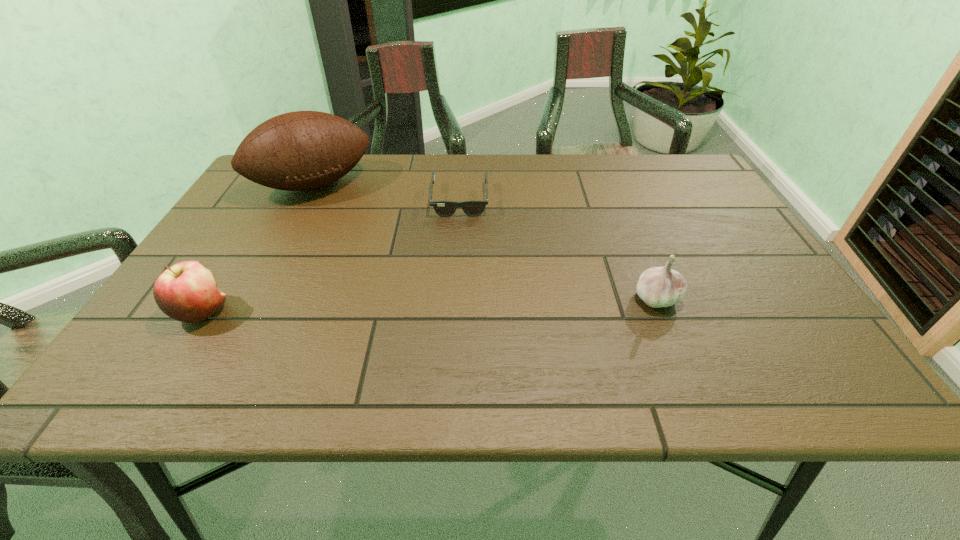
Where is `free area in between the sunglasses and the apple`? The height and width of the screenshot is (540, 960). free area in between the sunglasses and the apple is located at coordinates (331, 256).

Locate an element on the screen. This screenshot has width=960, height=540. vacant space that's between the rightmost object and the apple is located at coordinates (430, 305).

At what (x,y) coordinates should I click in order to perform the action: click on vacant area that lies between the apple and the sunglasses. Please return your answer as a coordinate pair (x, y). The width and height of the screenshot is (960, 540). Looking at the image, I should click on (331, 256).

Find the location of `free space between the second object from right to left and the tallest object`. free space between the second object from right to left and the tallest object is located at coordinates (387, 192).

Locate which object ranks in proximity to the football. Please provide its 2D coordinates. Your answer should be formatted as a tuple, i.e. [(x, y)], where the tuple contains the x and y coordinates of a point satisfying the conditions above.

[(473, 207)]

Identify which object is the closest to the garlic. Please provide its 2D coordinates. Your answer should be formatted as a tuple, i.e. [(x, y)], where the tuple contains the x and y coordinates of a point satisfying the conditions above.

[(473, 207)]

Identify the location of vacant space that satisfies the following two spatial constraints: 1. on the front side of the football; 2. on the left side of the shortest object. Image resolution: width=960 pixels, height=540 pixels. (306, 200).

At what (x,y) coordinates should I click in order to perform the action: click on vacant position in the image that satisfies the following two spatial constraints: 1. on the front side of the tallest object; 2. on the right side of the garlic. Please return your answer as a coordinate pair (x, y). Looking at the image, I should click on (255, 298).